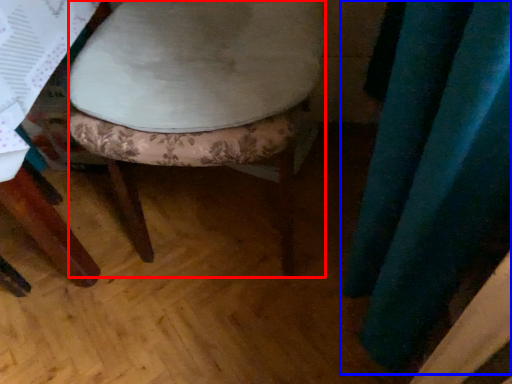
Question: Which of the following is the farthest to the observer, stool (highlighted by a red box) or curtain (highlighted by a blue box)?

Choices:
 (A) stool
 (B) curtain

Answer: (A)